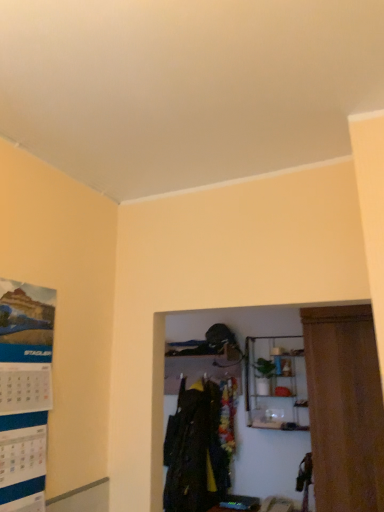
Question: Based on their sizes in the image, would you say dark green fabric coat at center is bigger or smaller than matte paper poster at left?

Choices:
 (A) big
 (B) small

Answer: (A)

Question: From the image's perspective, is dark green fabric coat at center above or below matte paper poster at left?

Choices:
 (A) below
 (B) above

Answer: (A)

Question: Which object is positioned closest to the matte paper poster at left?

Choices:
 (A) metallic wire shelf at upper center
 (B) dark green fabric coat at center

Answer: (B)

Question: Which is farther from the matte paper poster at left?

Choices:
 (A) metallic wire shelf at upper center
 (B) dark green fabric coat at center

Answer: (A)